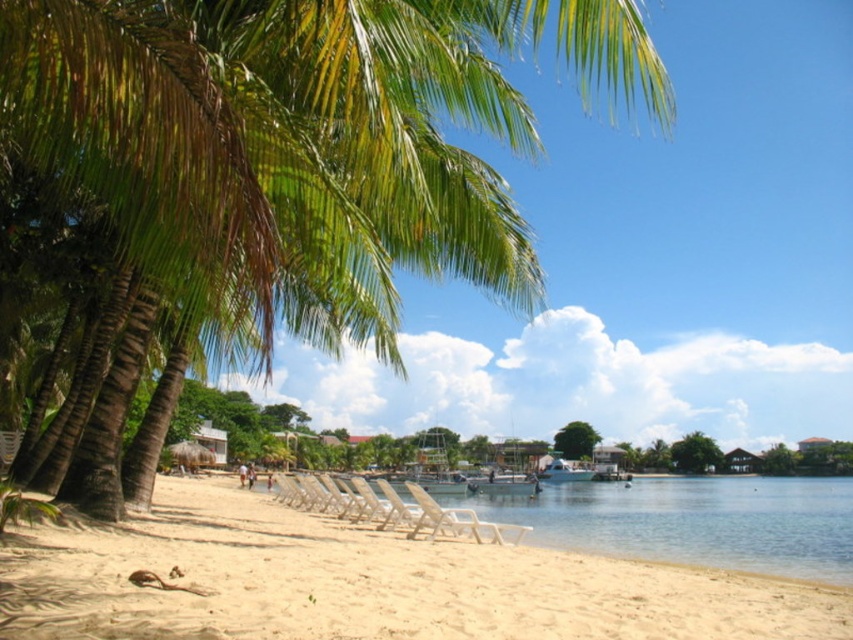
You are standing at the center of the beach scene. You want to take a photo of the green leafy palm tree at upper left. Which direction should you face to capture it in your camera?

You should face towards the upper left direction to capture the green leafy palm tree at upper left in your camera since it is located at point (x=302, y=144).

You are standing at the center of the beach scene. There is a point marked at coordinates point (369, 582). Based on the scene description, what object or feature is located at that point?

The point (369, 582) indicates beige sand at lower left.